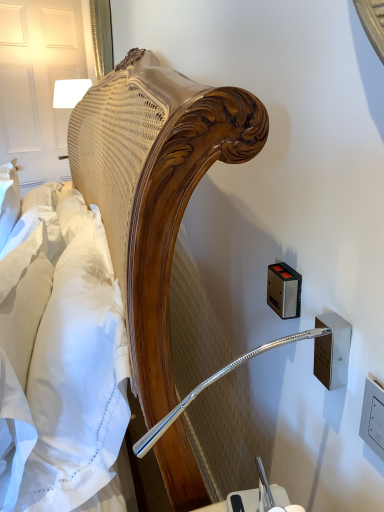
Question: In terms of height, does wooden bedside lamp at upper left look taller or shorter compared to metallic rectangular at right, arranged as the 1th electric outlet when viewed from the left?

Choices:
 (A) short
 (B) tall

Answer: (B)

Question: In terms of size, does wooden bedside lamp at upper left appear bigger or smaller than metallic rectangular at right, arranged as the 1th electric outlet when viewed from the left?

Choices:
 (A) big
 (B) small

Answer: (A)

Question: Based on their relative distances, which object is farther from the metallic silver outlet at right, which is the 2th electric outlet from back to front?

Choices:
 (A) metallic rectangular at right, arranged as the first electric outlet when viewed from the back
 (B) white cotton sheet at left
 (C) wooden bedside lamp at upper left

Answer: (C)

Question: Which object is the closest to the wooden bedside lamp at upper left?

Choices:
 (A) metallic rectangular at right, arranged as the first electric outlet when viewed from the back
 (B) white cotton sheet at left
 (C) metallic silver outlet at right, which is the 2th electric outlet from back to front

Answer: (B)